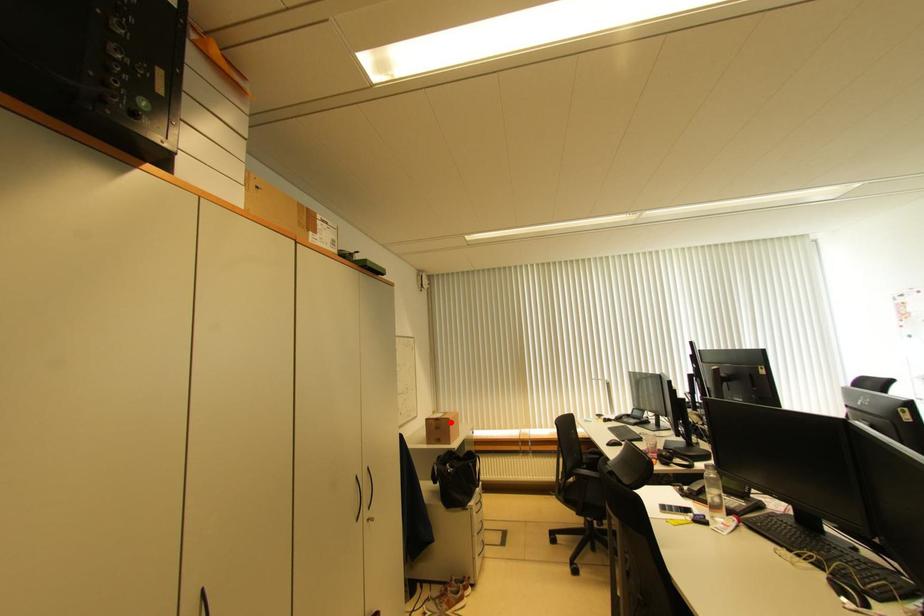
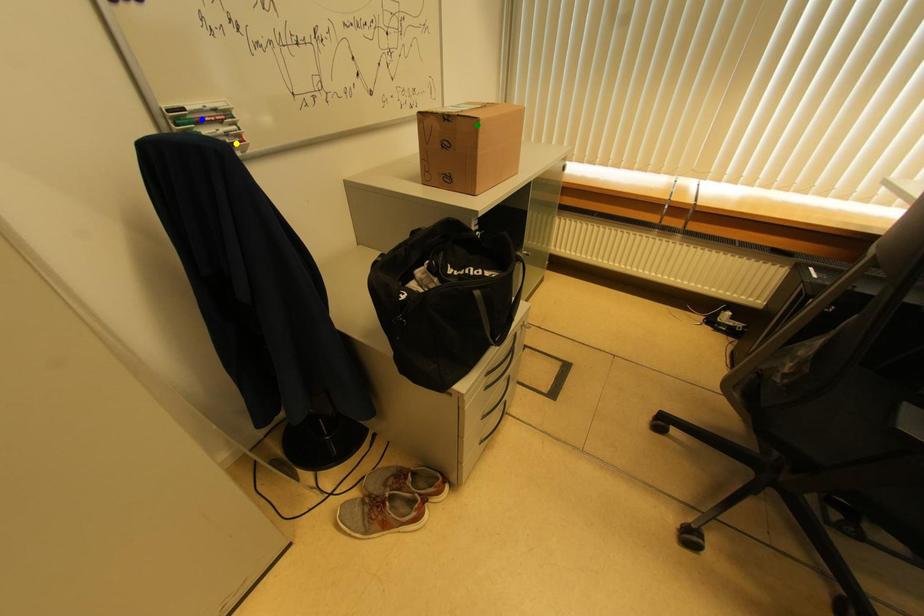
Question: I am providing you with two images of the same scene from different viewpoints. A red point is marked on the first image. You are given multiple points on the second image. Can you choose the point in image 2 that corresponds to the point in image 1?

Choices:
 (A) yellow point
 (B) blue point
 (C) green point

Answer: (C)